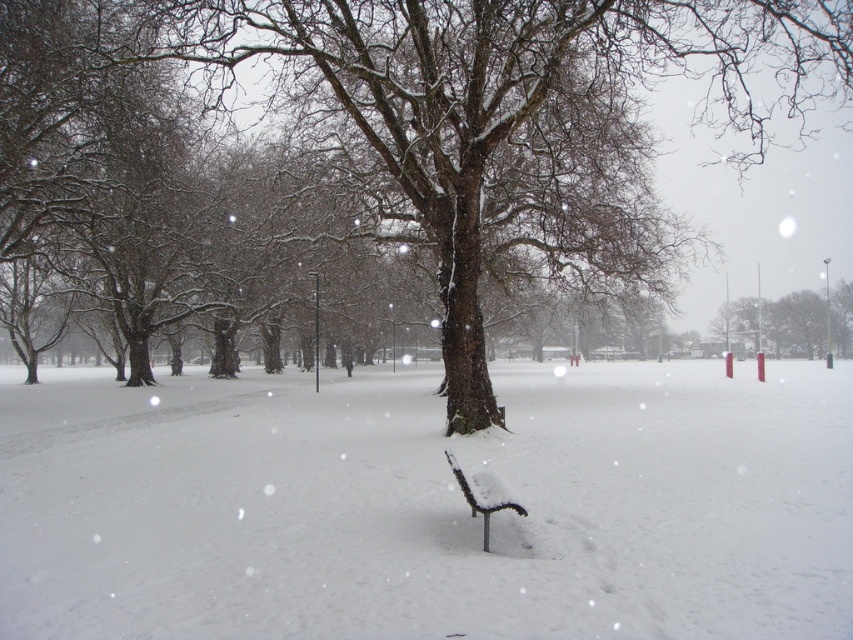
You are standing at the point marked as point [825,54] in the image. You want to walk to the nearest tree in the row of leafless trees. How far will you have to walk?

The nearest tree is 17.42 meters away from the point [825,54], so you will have to walk 17.42 meters.